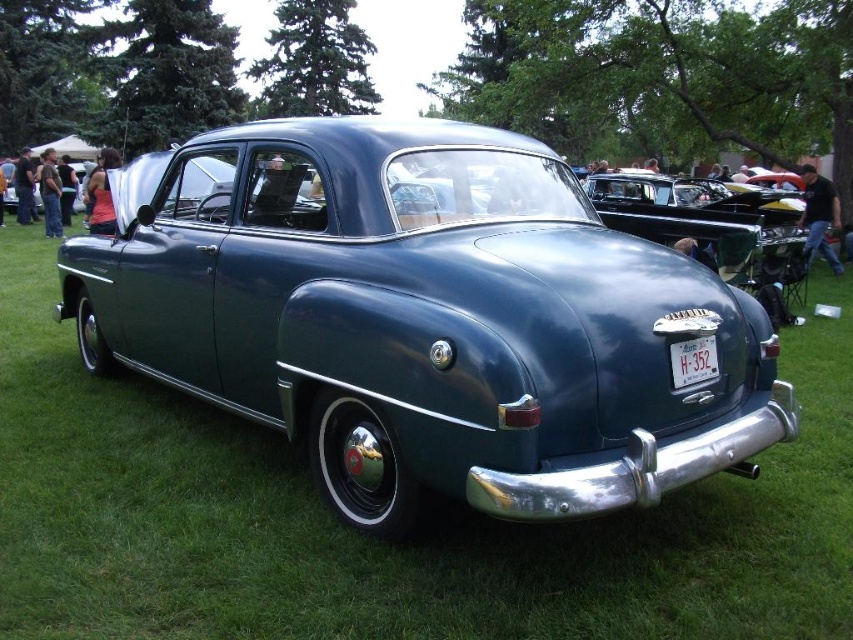
You are a photographer at the car show and want to take a picture of the metallic blue car at center and the white plastic license plate at center. From the car show attendee perspective, which object is positioned more to the right?

The white plastic license plate at center is positioned more to the right than the metallic blue car at center.

In the scene shown: You are standing at the camera position and want to place a small flower pot 2 meters away from you. Can you place it at point (x=383, y=141)?

The distance of point (x=383, y=141) from camera is 3.50 meters, so placing the flower pot at that point would be 3.50 meters away from you, which is further than the desired 2 meters. Choose a closer spot instead.

You are standing at the entrance of the car show and want to take a photo of the metallic blue car at center. If your camera has a maximum focus range of 8 feet, will you be able to capture a clear photo without moving closer?

The metallic blue car at center is 8.17 feet away from the viewer. Since the camera can only focus up to 8 feet, it is slightly out of range. To get a clear photo, you would need to move closer or use a different camera with a longer focus range.